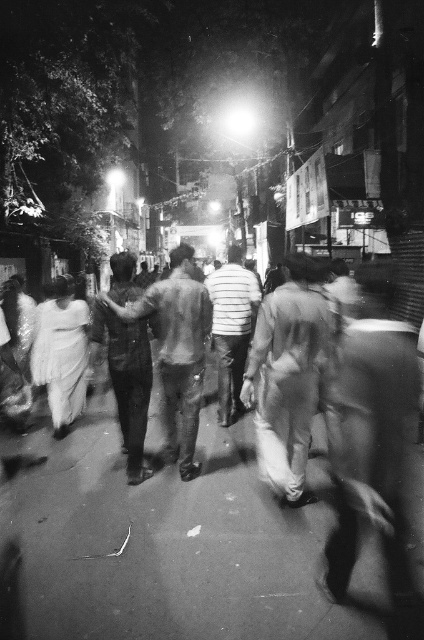
You are a photographer standing on a narrow street at night. You notice a smooth fabric crowd at center and a smooth fabric shirt at center in your viewfinder. Which object appears taller in the photo?

The smooth fabric shirt at center appears taller than the smooth fabric crowd at center because the smooth fabric crowd at center is shorter than smooth fabric shirt at center.